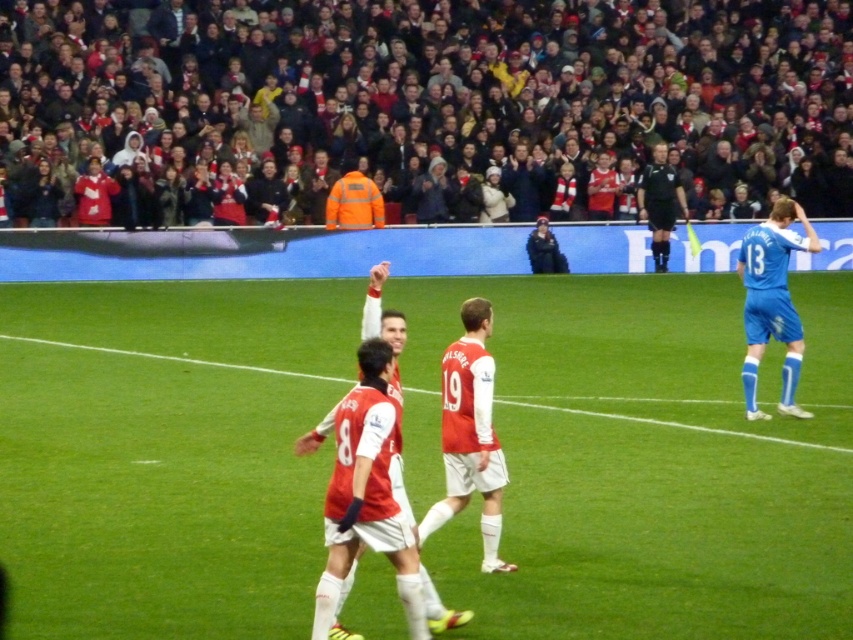
Can you confirm if blue smooth jersey at right is thinner than dark blue jacket at upper center?

Yes.

Based on the photo, who is higher up, blue smooth jersey at right or dark blue jacket at upper center?

dark blue jacket at upper center is higher up.

Where is `blue smooth jersey at right`? The width and height of the screenshot is (853, 640). blue smooth jersey at right is located at coordinates (772, 301).

Who is higher up, red matte jersey at center or black uniform at center?

black uniform at center

Can you confirm if red matte jersey at center is thinner than black uniform at center?

Yes, red matte jersey at center is thinner than black uniform at center.

Which is in front, point (392, 316) or point (677, 195)?

Point (392, 316) is in front.

Identify the location of red matte jersey at center. The width and height of the screenshot is (853, 640). (381, 312).

Can you confirm if red matte jersey at center is positioned to the right of dark blue jacket at upper center?

Incorrect, red matte jersey at center is not on the right side of dark blue jacket at upper center.

Is red matte jersey at center further to the viewer compared to dark blue jacket at upper center?

No, red matte jersey at center is closer to the viewer.

Is point (397, 410) positioned in front of point (544, 224)?

Yes.

Locate an element on the screen. The width and height of the screenshot is (853, 640). red matte jersey at center is located at coordinates (381, 312).